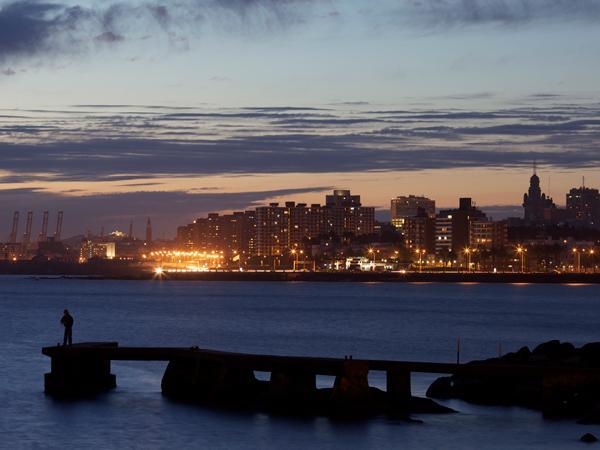
Locate an element on the screen. The image size is (600, 450). very well lighted venue on left side of image is located at coordinates (194, 262).